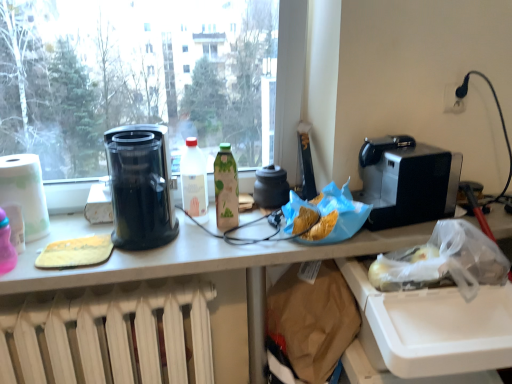
Question: Is white paper towel at left far away from satin black coffee machine at right?

Choices:
 (A) yes
 (B) no

Answer: (A)

Question: Can you confirm if white paper towel at left is taller than satin black coffee machine at right?

Choices:
 (A) yes
 (B) no

Answer: (A)

Question: Does white paper towel at left have a greater width compared to satin black coffee machine at right?

Choices:
 (A) yes
 (B) no

Answer: (B)

Question: Does white paper towel at left have a larger size compared to satin black coffee machine at right?

Choices:
 (A) no
 (B) yes

Answer: (A)

Question: Is white paper towel at left thinner than satin black coffee machine at right?

Choices:
 (A) yes
 (B) no

Answer: (A)

Question: Considering the positions of golden crispy chips at center, which is counted as the second food, starting from the left, and white radiator at lower center in the image, is golden crispy chips at center, which is counted as the second food, starting from the left, taller or shorter than white radiator at lower center?

Choices:
 (A) tall
 (B) short

Answer: (B)

Question: From a real-world perspective, is golden crispy chips at center, which is the 1th food in right-to-left order, above or below white radiator at lower center?

Choices:
 (A) below
 (B) above

Answer: (B)

Question: Is golden crispy chips at center, which is counted as the second food, starting from the left, wider or thinner than white radiator at lower center?

Choices:
 (A) thin
 (B) wide

Answer: (B)

Question: Considering the positions of golden crispy chips at center, which is the 1th food in right-to-left order, and white radiator at lower center in the image, is golden crispy chips at center, which is the 1th food in right-to-left order, bigger or smaller than white radiator at lower center?

Choices:
 (A) small
 (B) big

Answer: (A)

Question: Is point (41, 236) closer or farther from the camera than point (152, 200)?

Choices:
 (A) closer
 (B) farther

Answer: (B)

Question: From a real-world perspective, is white paper towel at left positioned above or below transparent plastic coffee maker at left?

Choices:
 (A) above
 (B) below

Answer: (B)

Question: From the image's perspective, is white paper towel at left located above or below transparent plastic coffee maker at left?

Choices:
 (A) below
 (B) above

Answer: (A)

Question: Based on their positions, is white paper towel at left located to the left or right of transparent plastic coffee maker at left?

Choices:
 (A) left
 (B) right

Answer: (A)

Question: Considering the positions of point (82, 332) and point (175, 34), is point (82, 332) closer or farther from the camera than point (175, 34)?

Choices:
 (A) farther
 (B) closer

Answer: (B)

Question: From the image's perspective, is white radiator at lower center above or below transparent glass window at upper left?

Choices:
 (A) below
 (B) above

Answer: (A)